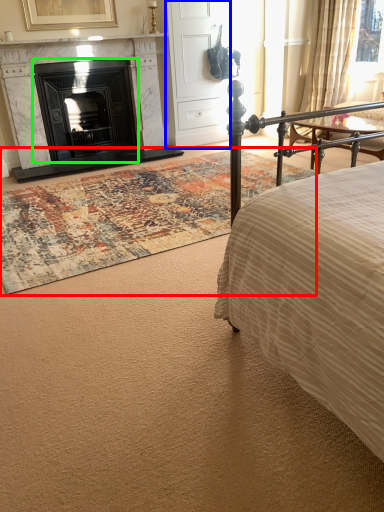
Question: Which object is the farthest from mat (highlighted by a red box)? Choose among these: armoire (highlighted by a blue box) or fireplace (highlighted by a green box).

Choices:
 (A) armoire
 (B) fireplace

Answer: (A)